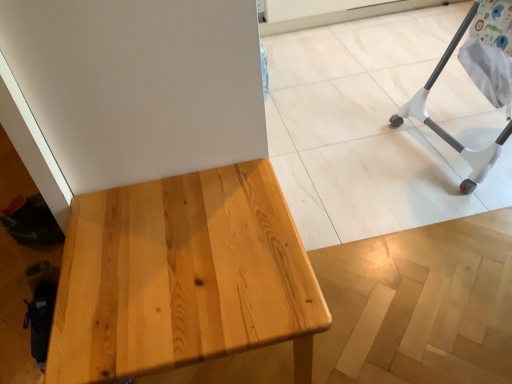
The width and height of the screenshot is (512, 384). What are the coordinates of `free area in between natural wood table at center and white plastic baby bouncer at right` in the screenshot? It's located at (382, 215).